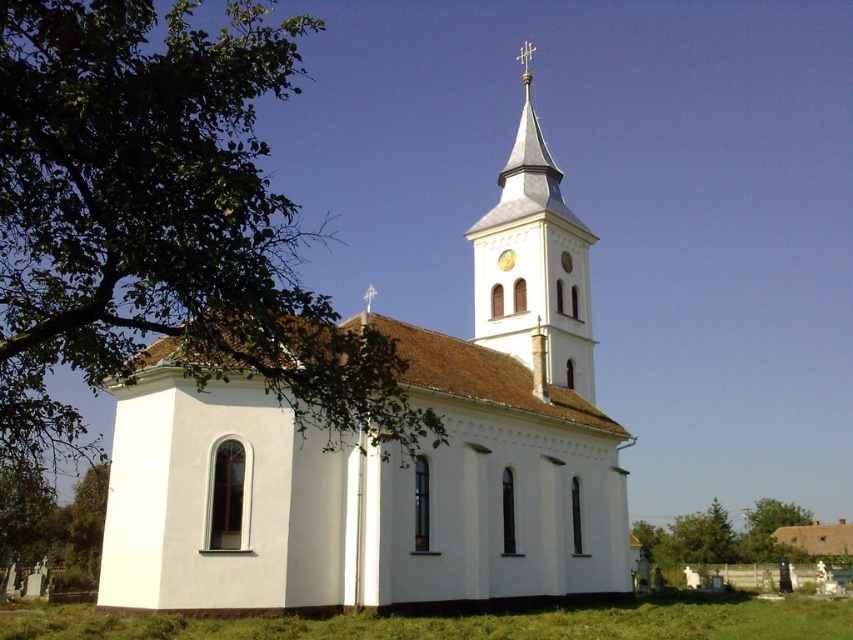
You are standing in front of the church and want to take a photo that includes both the green leafy tree at upper left and the green grass at lower center. Which object will appear larger in the photo?

The green leafy tree at upper left will appear larger in the photo because it is taller than the green grass at lower center.

In the scene shown: You are standing in front of the church and want to take a photo that includes both the green leafy tree at upper left and the green grass at lower center. Which object should you position to the left side of your camera frame?

The green leafy tree at upper left should be positioned to the left side of your camera frame since it is located to the left of the green grass at lower center.